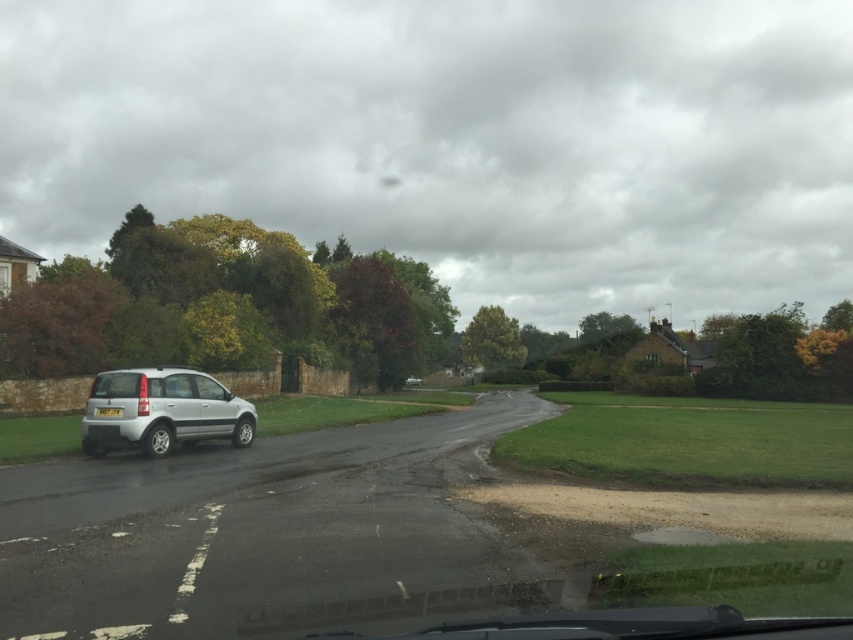
You are driving a car and see the silver metallic car at left and the white plastic license plate at center. Which object is closer to you?

The silver metallic car at left is closer to you than the white plastic license plate at center.

You are driving a car with a 4.2 meter length. You need to turn right at the upcoming curve. The point at (204,378) is the center of the curve. Can your car safely make the turn without hitting the stone wall on the left or the houses on the right?

The distance between the points is 19.71 meters, which is greater than the car length of 4.2 meters. Therefore, the car can safely make the turn without hitting the stone wall or the houses.